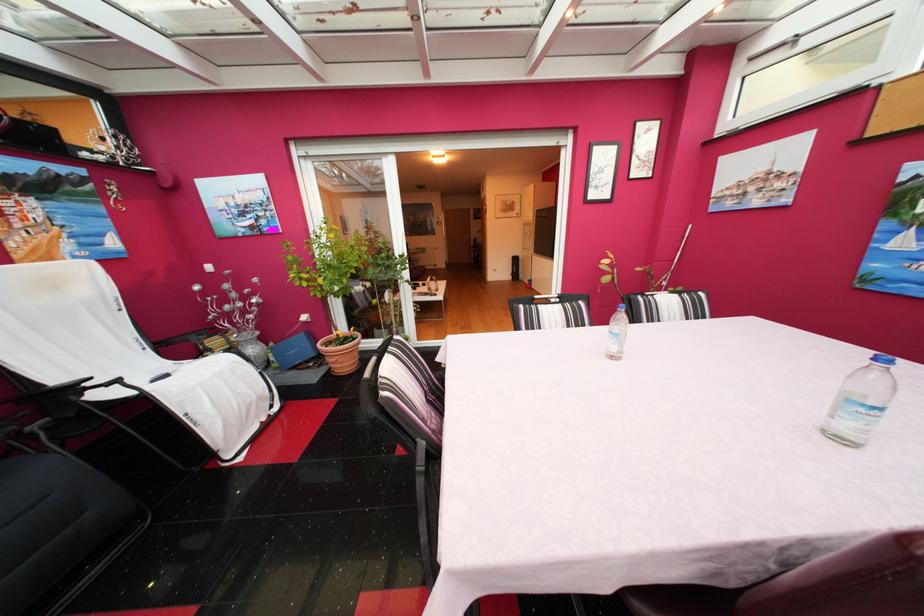
Where is `white power outlet`? The height and width of the screenshot is (616, 924). white power outlet is located at coordinates (209, 268).